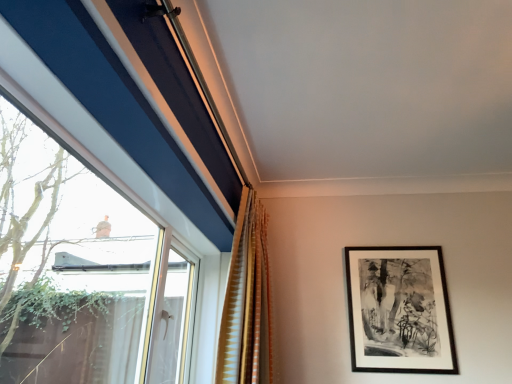
Measure the distance between gold textured curtain at center and camera.

They are 1.85 meters apart.

You are a GUI agent. You are given a task and a screenshot of the screen. Output one action in this format:
    pyautogui.click(x=<x>, y=<y>)
    Task: Click on the gold textured curtain at center
    This screenshot has height=384, width=512.
    Given the screenshot: What is the action you would take?
    pyautogui.click(x=247, y=301)

The width and height of the screenshot is (512, 384). What do you see at coordinates (247, 301) in the screenshot?
I see `gold textured curtain at center` at bounding box center [247, 301].

I want to click on black matte picture frame at upper right, so click(399, 310).

The width and height of the screenshot is (512, 384). What do you see at coordinates (399, 310) in the screenshot? I see `black matte picture frame at upper right` at bounding box center [399, 310].

You are a GUI agent. You are given a task and a screenshot of the screen. Output one action in this format:
    pyautogui.click(x=<x>, y=<y>)
    Task: Click on the gold textured curtain at center
    
    Given the screenshot: What is the action you would take?
    pyautogui.click(x=247, y=301)

In the scene shown: Does black matte picture frame at upper right appear on the left side of gold textured curtain at center?

In fact, black matte picture frame at upper right is to the right of gold textured curtain at center.

In the image, is black matte picture frame at upper right positioned in front of or behind gold textured curtain at center?

In the image, black matte picture frame at upper right appears behind gold textured curtain at center.

Which is behind, point (403, 264) or point (240, 278)?

The point (403, 264) is farther.

From the image's perspective, is black matte picture frame at upper right over gold textured curtain at center?

No, from the image's perspective, black matte picture frame at upper right is not over gold textured curtain at center.

From a real-world perspective, which object rests below the other?

In real-world perspective, black matte picture frame at upper right is lower.

Which object is thinner, black matte picture frame at upper right or gold textured curtain at center?

black matte picture frame at upper right.

Considering the relative sizes of black matte picture frame at upper right and gold textured curtain at center in the image provided, is black matte picture frame at upper right taller than gold textured curtain at center?

Incorrect, the height of black matte picture frame at upper right is not larger of that of gold textured curtain at center.

Based on their sizes in the image, would you say black matte picture frame at upper right is bigger or smaller than gold textured curtain at center?

black matte picture frame at upper right is smaller than gold textured curtain at center.

Is black matte picture frame at upper right situated inside gold textured curtain at center or outside?

black matte picture frame at upper right is outside gold textured curtain at center.

Would you consider black matte picture frame at upper right to be distant from gold textured curtain at center?

No, there isn't a large distance between black matte picture frame at upper right and gold textured curtain at center.

Does black matte picture frame at upper right turn towards gold textured curtain at center?

No, black matte picture frame at upper right is not aimed at gold textured curtain at center.

What's the angular difference between black matte picture frame at upper right and gold textured curtain at center's facing directions?

black matte picture frame at upper right and gold textured curtain at center are facing 84.9 degrees away from each other.

Find the location of a particular element. The height and width of the screenshot is (384, 512). curtain on the left of the black matte picture frame at upper right is located at coordinates (247, 301).

Considering the positions of objects gold textured curtain at center and black matte picture frame at upper right in the image provided, who is more to the right, gold textured curtain at center or black matte picture frame at upper right?

From the viewer's perspective, black matte picture frame at upper right appears more on the right side.

Looking at this image, considering their positions, is gold textured curtain at center located in front of or behind black matte picture frame at upper right?

gold textured curtain at center is positioned closer to the viewer than black matte picture frame at upper right.

Considering the positions of point (248, 323) and point (408, 347), is point (248, 323) closer or farther from the camera than point (408, 347)?

Point (248, 323) is positioned closer to the camera compared to point (408, 347).

From the image's perspective, which one is positioned lower, gold textured curtain at center or black matte picture frame at upper right?

black matte picture frame at upper right, from the image's perspective.

From a real-world perspective, is gold textured curtain at center physically located above or below black matte picture frame at upper right?

Clearly, from a real-world perspective, gold textured curtain at center is above black matte picture frame at upper right.

Looking at this image, which of these two, gold textured curtain at center or black matte picture frame at upper right, is wider?

With larger width is gold textured curtain at center.

Does gold textured curtain at center have a lesser height compared to black matte picture frame at upper right?

No.

Is gold textured curtain at center bigger than black matte picture frame at upper right?

Correct, gold textured curtain at center is larger in size than black matte picture frame at upper right.

Would you say gold textured curtain at center is inside or outside black matte picture frame at upper right?

gold textured curtain at center exists outside the volume of black matte picture frame at upper right.

Would you say gold textured curtain at center is a long distance from black matte picture frame at upper right?

No, there isn't a large distance between gold textured curtain at center and black matte picture frame at upper right.

Does gold textured curtain at center turn towards black matte picture frame at upper right?

Yes.

How many degrees apart are the facing directions of gold textured curtain at center and black matte picture frame at upper right?

The facing directions of gold textured curtain at center and black matte picture frame at upper right are 84.9 degrees apart.

Based on the photo, measure the distance between gold textured curtain at center and black matte picture frame at upper right.

gold textured curtain at center is 25.56 inches from black matte picture frame at upper right.

Where is `picture frame that is under the gold textured curtain at center (from a real-world perspective)`? picture frame that is under the gold textured curtain at center (from a real-world perspective) is located at coordinates (399, 310).

What are the coordinates of `curtain above the black matte picture frame at upper right (from the image's perspective)` in the screenshot? It's located at (247, 301).

Where is `picture frame that is behind the gold textured curtain at center`? This screenshot has height=384, width=512. picture frame that is behind the gold textured curtain at center is located at coordinates (399, 310).